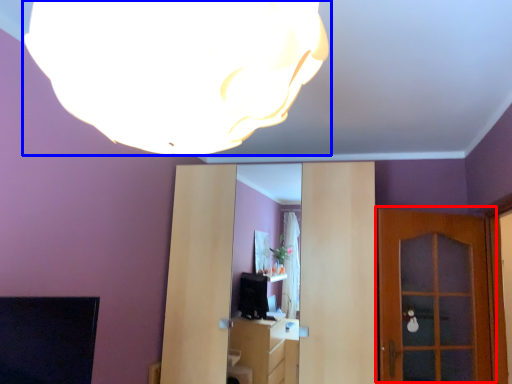
Question: Which object is further to the camera taking this photo, door (highlighted by a red box) or lamp (highlighted by a blue box)?

Choices:
 (A) door
 (B) lamp

Answer: (A)